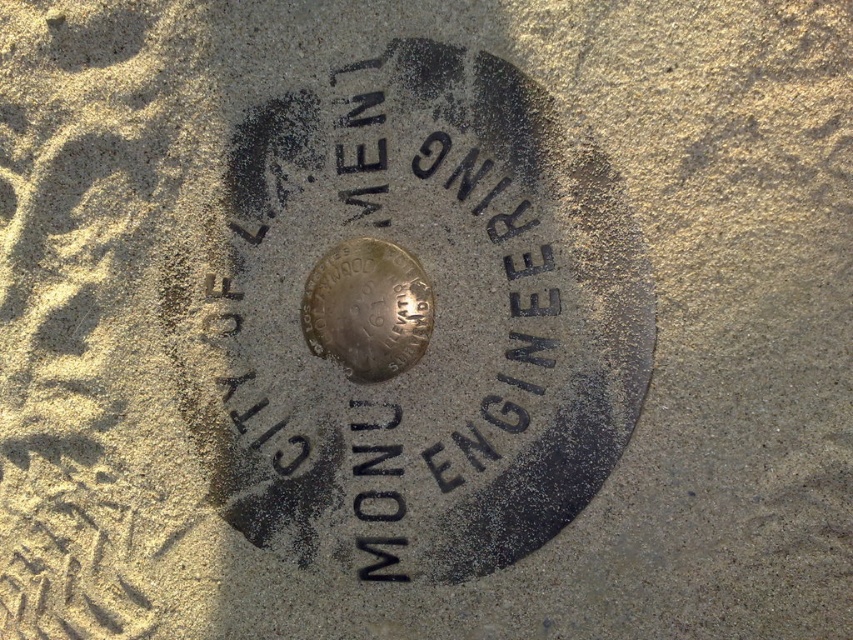
You are standing in a park and see a black metal marker at center. You want to place a 1.5 meter long bench next to it without touching the marker. Is there enough space between you and the marker to do this?

The distance between you and the black metal marker at center is 1.85 meters. Since the bench is 1.5 meters long, there is sufficient space to place it next to the marker without touching it, as 1.85 meters is greater than 1.5 meters.

You are an archaeologist examining the plaque. You notice two items at the center of the plaque. The black metal marker at center and the shiny metallic coin at center. Which one has a greater width?

The black metal marker at center has a greater width than the shiny metallic coin at center.